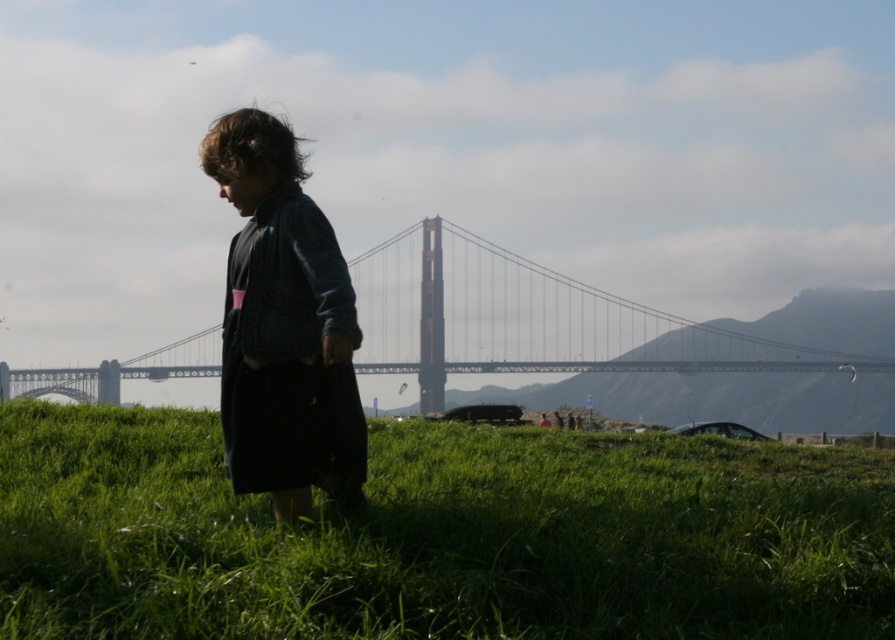
Question: Which of the following is the closest to the observer?

Choices:
 (A) dark blue denim jacket at center
 (B) metallic bridge at center
 (C) green grassy field at lower center

Answer: (C)

Question: Based on their relative distances, which object is nearer to the dark blue denim jacket at center?

Choices:
 (A) green grassy field at lower center
 (B) metallic bridge at center

Answer: (A)

Question: Can you confirm if metallic bridge at center is positioned below dark blue denim jacket at center?

Choices:
 (A) yes
 (B) no

Answer: (B)

Question: Is metallic bridge at center thinner than dark blue denim jacket at center?

Choices:
 (A) yes
 (B) no

Answer: (B)

Question: Which object is the closest to the dark blue denim jacket at center?

Choices:
 (A) green grassy field at lower center
 (B) metallic bridge at center

Answer: (A)

Question: Is green grassy field at lower center smaller than metallic bridge at center?

Choices:
 (A) yes
 (B) no

Answer: (A)